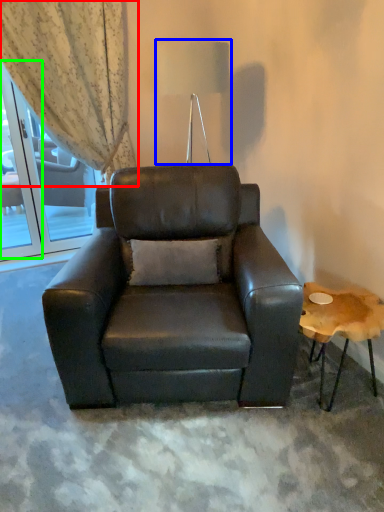
Question: Based on their relative distances, which object is farther from curtain (highlighted by a red box)? Choose from table lamp (highlighted by a blue box) and screen door (highlighted by a green box).

Choices:
 (A) table lamp
 (B) screen door

Answer: (A)